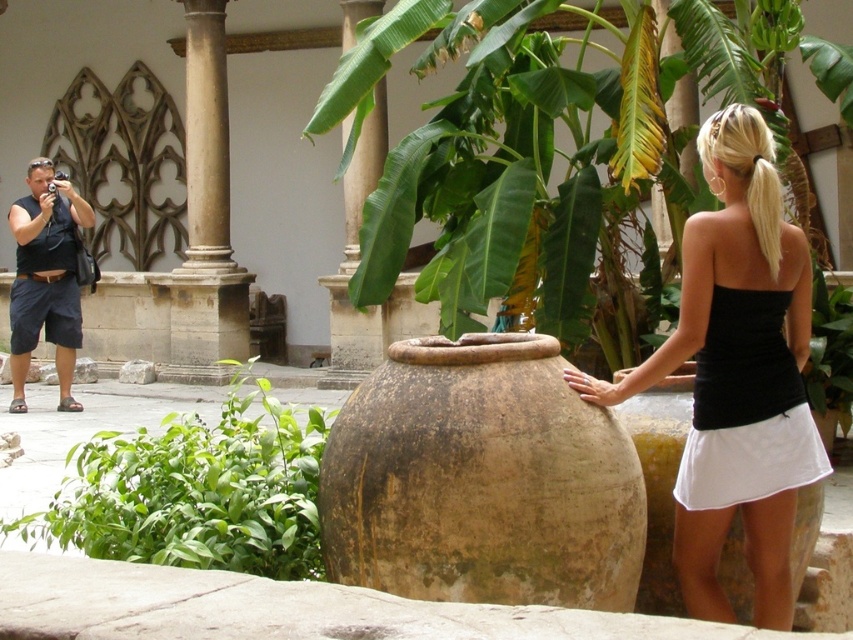
You are a gardener planning to place a new flower arrangement in the courtyard. You have a new decorative item that is 40 cm wide. The brown earthenware vase at center currently occupies the central area. Can the beige stone pillar at left accommodate the new item in terms of width without moving the existing objects?

The beige stone pillar at left is wider than the brown earthenware vase at center. Since the new item is 40 cm wide, you need to check the width of the beige stone pillar at left. If it is wider than 40 cm, the item can fit. However, without specific measurements, we can only confirm that the beige stone pillar at left is wider than the brown earthenware vase at center.

You are an archaeologist examining the courtyard. You see the brown earthenware vase at center and the beige stone pillar at left. Which object is positioned lower in the scene?

The brown earthenware vase at center is located below beige stone pillar at left, so it is positioned lower in the scene.

You are standing in a courtyard with a black matte tank top at center and a beige stone pillar at left. Which object is shorter?

The black matte tank top at center is shorter than the beige stone pillar at left.